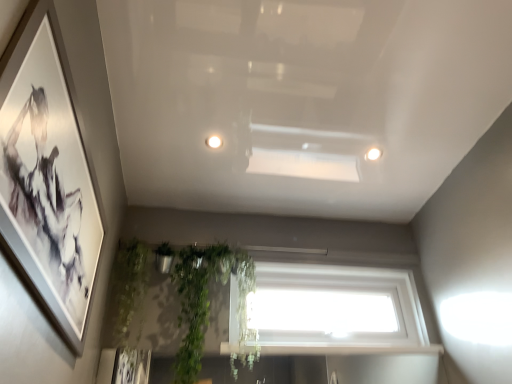
Question: From the image's perspective, is white glossy window sill at lower center below white glossy light fixture at upper right, the first lighting from the bottom?

Choices:
 (A) no
 (B) yes

Answer: (B)

Question: Does white glossy window sill at lower center have a lesser height compared to white glossy light fixture at upper right, which appears as the second lighting when viewed from the front?

Choices:
 (A) yes
 (B) no

Answer: (B)

Question: Is white glossy window sill at lower center far away from white glossy light fixture at upper right, the 1th lighting from the right?

Choices:
 (A) yes
 (B) no

Answer: (B)

Question: Is white glossy window sill at lower center facing towards white glossy light fixture at upper right, the 1th lighting from the right?

Choices:
 (A) no
 (B) yes

Answer: (A)

Question: Is white glossy window sill at lower center smaller than white glossy light fixture at upper right, which appears as the second lighting when viewed from the front?

Choices:
 (A) yes
 (B) no

Answer: (B)

Question: From a real-world perspective, is white glossy window sill at lower center beneath white glossy light fixture at upper right, the first lighting from the bottom?

Choices:
 (A) yes
 (B) no

Answer: (A)

Question: From a real-world perspective, is white glossy light fixture at upper right, the 1th lighting from the right, physically above green leafy plant at lower left?

Choices:
 (A) yes
 (B) no

Answer: (A)

Question: Is white glossy light fixture at upper right, the 1th lighting from the right, wider than green leafy plant at lower left?

Choices:
 (A) no
 (B) yes

Answer: (A)

Question: Are white glossy light fixture at upper right, the first lighting from the bottom, and green leafy plant at lower left located far from each other?

Choices:
 (A) yes
 (B) no

Answer: (A)

Question: From the image's perspective, would you say white glossy light fixture at upper right, the first lighting from the bottom, is shown under green leafy plant at lower left?

Choices:
 (A) no
 (B) yes

Answer: (A)

Question: Is white glossy light fixture at upper right, which appears as the second lighting when viewed from the left, smaller than green leafy plant at lower left?

Choices:
 (A) yes
 (B) no

Answer: (A)

Question: Can you confirm if white glossy light fixture at upper right, positioned as the first lighting in back-to-front order, is bigger than green leafy plant at lower left?

Choices:
 (A) no
 (B) yes

Answer: (A)

Question: From the image's perspective, would you say white glossy light fixture at upper right, which appears as the second lighting when viewed from the left, is shown under matte black picture frame at left?

Choices:
 (A) yes
 (B) no

Answer: (B)